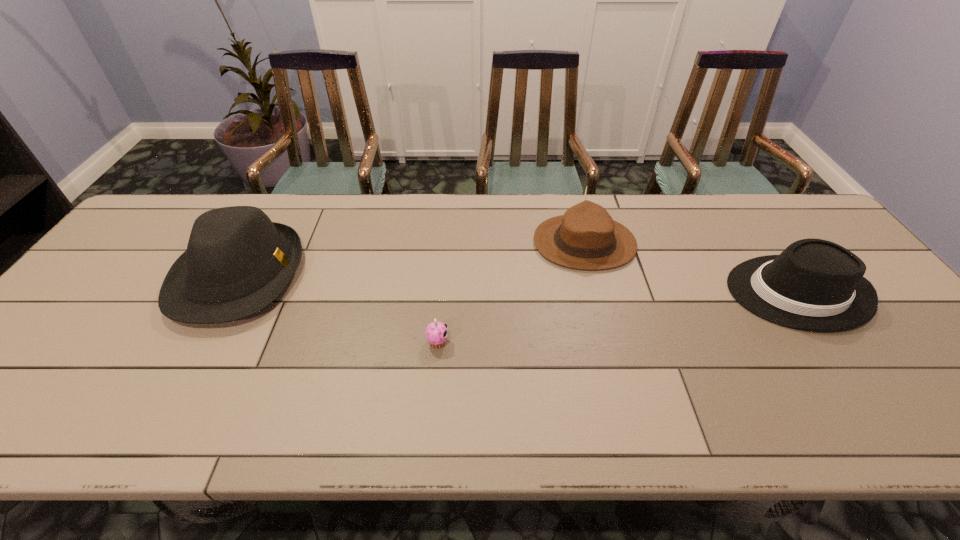
Where is `the tallest fedora`? the tallest fedora is located at coordinates (237, 262).

Locate an element on the screen. the leftmost object is located at coordinates (237, 262).

This screenshot has width=960, height=540. What are the coordinates of `the second object from right to left` in the screenshot? It's located at (586, 237).

Where is `the rightmost fedora`? Image resolution: width=960 pixels, height=540 pixels. the rightmost fedora is located at coordinates (816, 285).

Find the location of a particular element. The height and width of the screenshot is (540, 960). cupcake is located at coordinates (436, 333).

In order to click on the shortest object in this screenshot , I will do `click(436, 333)`.

The image size is (960, 540). What are the coordinates of `vacant space situated 0.360m on the front-facing side of the tallest fedora` in the screenshot? It's located at (434, 276).

Where is `free region located on the feather side of the second object from right to left`? The height and width of the screenshot is (540, 960). free region located on the feather side of the second object from right to left is located at coordinates (445, 243).

Locate an element on the screen. free space located 0.390m on the feather side of the second object from right to left is located at coordinates (401, 243).

Locate an element on the screen. The height and width of the screenshot is (540, 960). vacant space located on the feather side of the second object from right to left is located at coordinates (483, 243).